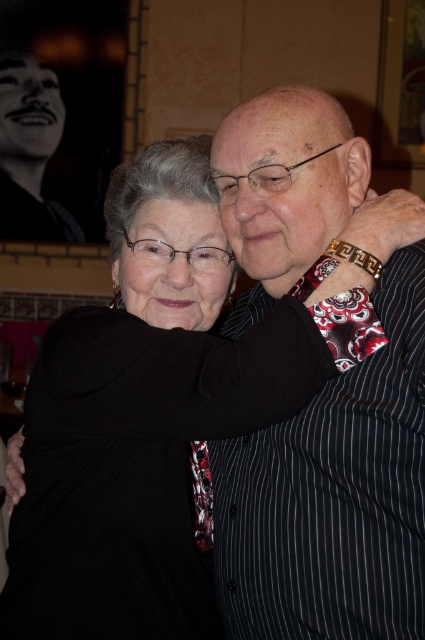
Based on the scene description, where is the black striped shirt at center located in terms of coordinates?

The black striped shirt at center is located at coordinates point (334,496).

You are a photographer adjusting the lighting for a portrait. You notice the black striped shirt at center and the black fabric at center in the image. Which object should you focus on to ensure proper exposure since it is closer to the camera?

The black striped shirt at center is located below black fabric at center, so the black fabric at center is closer to the camera. Focus on the black fabric at center for proper exposure.